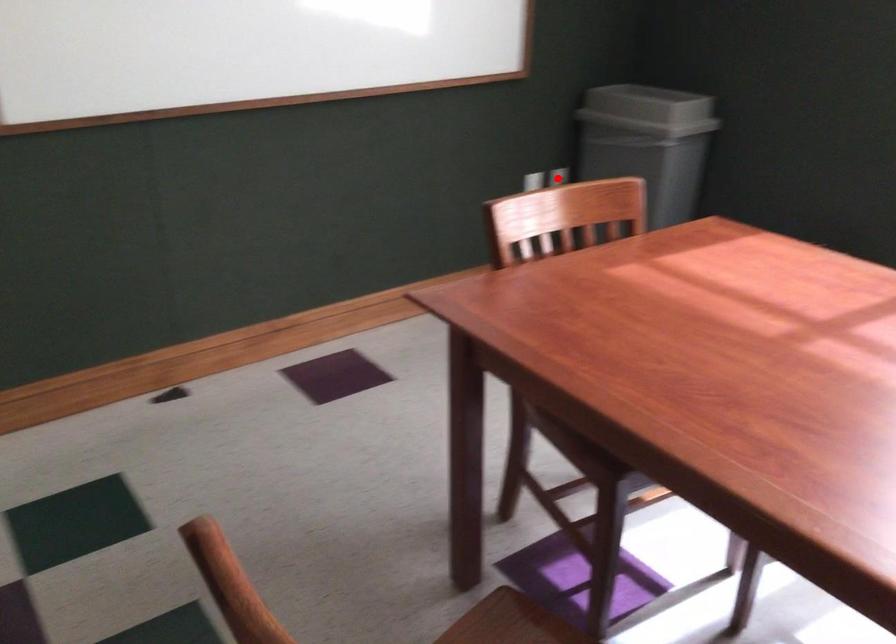
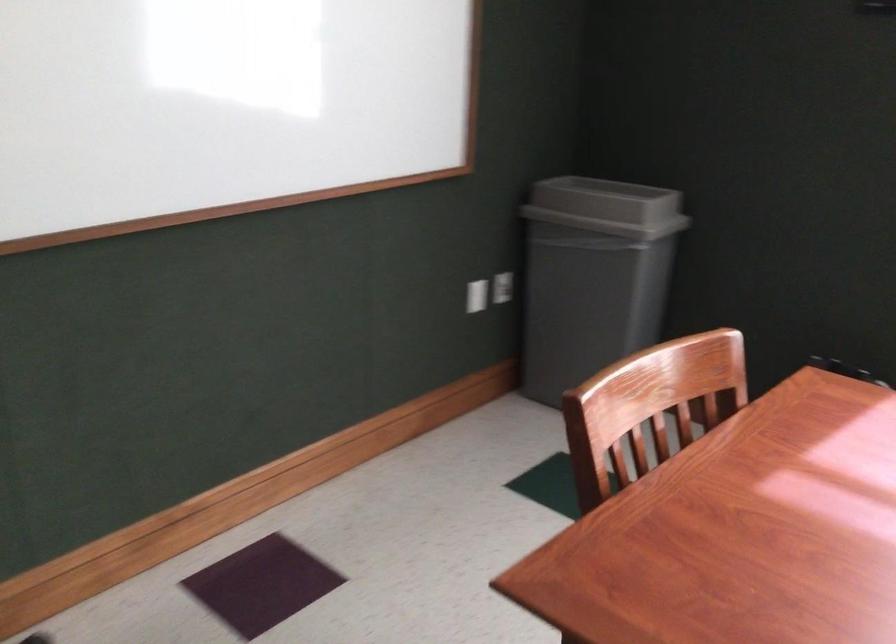
In the second image, find the point that corresponds to the highlighted location in the first image.

(503, 287)